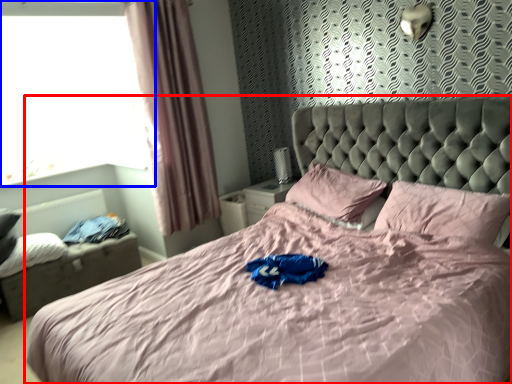
Question: Which of the following is the farthest to the observer, bed (highlighted by a red box) or window (highlighted by a blue box)?

Choices:
 (A) bed
 (B) window

Answer: (B)